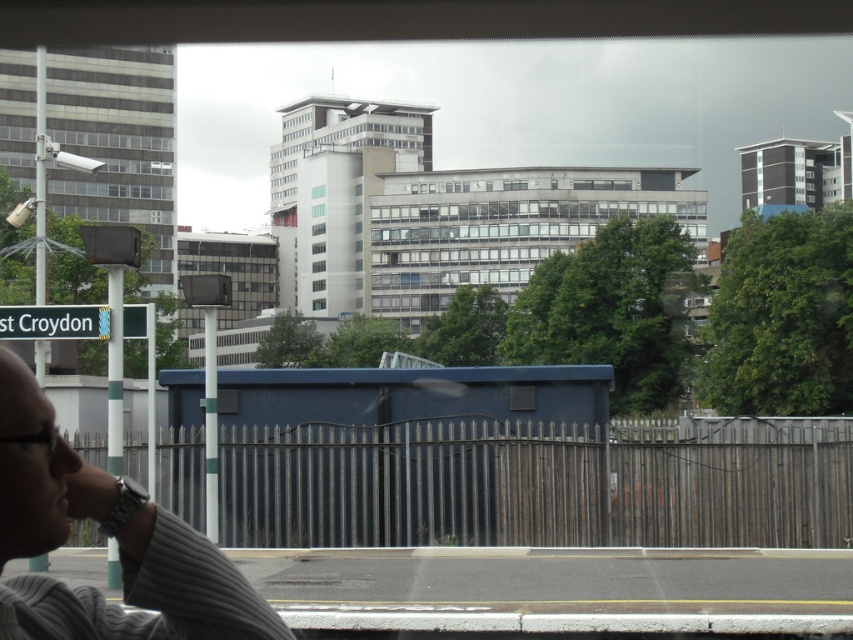
Question: Can you confirm if blue metallic bus stop at center is thinner than gray striped shirt at lower left?

Choices:
 (A) yes
 (B) no

Answer: (B)

Question: Can you confirm if blue metallic bus stop at center is positioned below gray striped shirt at lower left?

Choices:
 (A) no
 (B) yes

Answer: (B)

Question: Among these points, which one is nearest to the camera?

Choices:
 (A) (303, 492)
 (B) (224, 608)
 (C) (97, 317)

Answer: (B)

Question: Among these objects, which one is farthest from the camera?

Choices:
 (A) blue metallic bus stop at center
 (B) white plastic street sign at lower left
 (C) gray striped shirt at lower left

Answer: (A)

Question: Which of these objects is positioned closest to the white plastic street sign at lower left?

Choices:
 (A) gray striped shirt at lower left
 (B) blue metallic bus stop at center

Answer: (B)

Question: Is blue metallic bus stop at center wider than gray striped shirt at lower left?

Choices:
 (A) no
 (B) yes

Answer: (B)